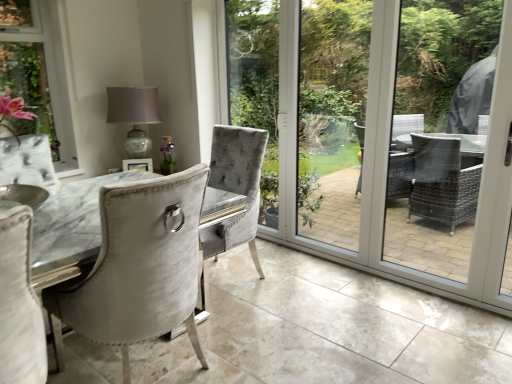
Question: From a real-world perspective, is matte glass table lamp at upper center physically above clear glass screen door at center, the second screen door viewed from the right?

Choices:
 (A) no
 (B) yes

Answer: (A)

Question: Is matte glass table lamp at upper center to the left of clear glass screen door at center, the second screen door viewed from the right, from the viewer's perspective?

Choices:
 (A) yes
 (B) no

Answer: (A)

Question: Is matte glass table lamp at upper center facing away from clear glass screen door at center, the second screen door viewed from the right?

Choices:
 (A) no
 (B) yes

Answer: (A)

Question: Is matte glass table lamp at upper center not close to clear glass screen door at center, the 1th screen door viewed from the left?

Choices:
 (A) yes
 (B) no

Answer: (A)

Question: From the image's perspective, would you say matte glass table lamp at upper center is positioned over clear glass screen door at center, the second screen door viewed from the right?

Choices:
 (A) no
 (B) yes

Answer: (B)

Question: Is matte glass table lamp at upper center spatially inside satin white chair at center, or outside of it?

Choices:
 (A) inside
 (B) outside

Answer: (B)

Question: In terms of size, does matte glass table lamp at upper center appear bigger or smaller than satin white chair at center?

Choices:
 (A) small
 (B) big

Answer: (A)

Question: Considering the positions of point (114, 120) and point (150, 319), is point (114, 120) closer or farther from the camera than point (150, 319)?

Choices:
 (A) closer
 (B) farther

Answer: (B)

Question: From a real-world perspective, relative to satin white chair at center, is matte glass table lamp at upper center vertically above or below?

Choices:
 (A) above
 (B) below

Answer: (A)

Question: Would you say clear glass screen door at center, the second screen door viewed from the right, is to the left or to the right of matte glass table lamp at upper center in the picture?

Choices:
 (A) left
 (B) right

Answer: (B)

Question: Considering the positions of clear glass screen door at center, the second screen door viewed from the right, and matte glass table lamp at upper center in the image, is clear glass screen door at center, the second screen door viewed from the right, taller or shorter than matte glass table lamp at upper center?

Choices:
 (A) short
 (B) tall

Answer: (B)

Question: From the image's perspective, relative to matte glass table lamp at upper center, is clear glass screen door at center, the second screen door viewed from the right, above or below?

Choices:
 (A) above
 (B) below

Answer: (B)

Question: Is clear glass screen door at center, the 1th screen door viewed from the left, wider or thinner than matte glass table lamp at upper center?

Choices:
 (A) thin
 (B) wide

Answer: (A)

Question: In terms of width, does satin white chair at center look wider or thinner when compared to clear glass screen door at center, the second screen door viewed from the right?

Choices:
 (A) wide
 (B) thin

Answer: (A)

Question: Looking at the image, does satin white chair at center seem bigger or smaller compared to clear glass screen door at center, the second screen door viewed from the right?

Choices:
 (A) small
 (B) big

Answer: (B)